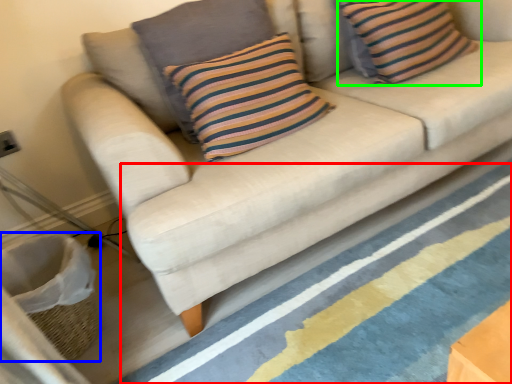
Question: Based on their relative distances, which object is nearer to stripe (highlighted by a red box)? Choose from basket (highlighted by a blue box) and pillow (highlighted by a green box).

Choices:
 (A) basket
 (B) pillow

Answer: (A)